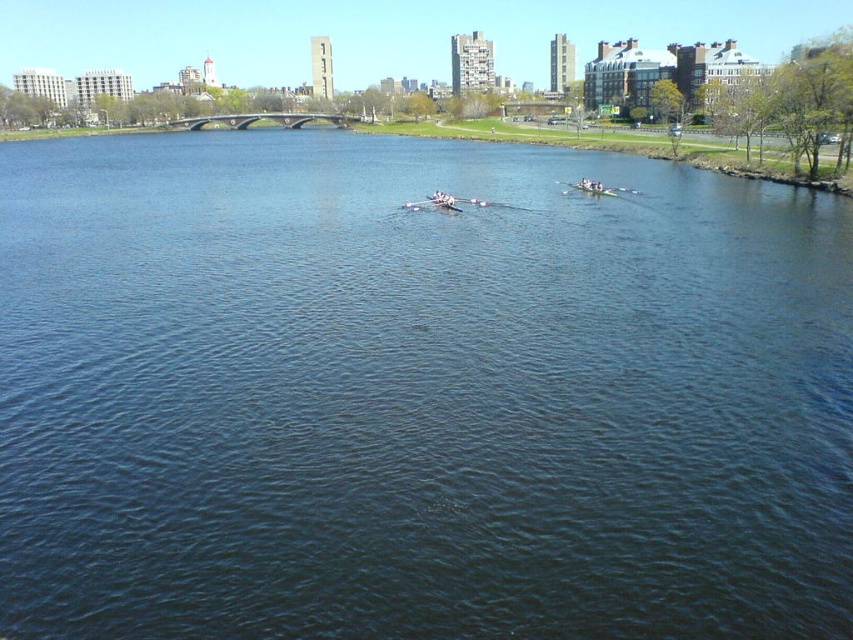
Between white glossy canoe at center and smooth white oar at center, which one appears on the left side from the viewer's perspective?

smooth white oar at center is more to the left.

Consider the image. Is white glossy canoe at center smaller than smooth white oar at center?

Actually, white glossy canoe at center might be larger than smooth white oar at center.

Is point (595, 189) behind point (418, 204)?

Yes, point (595, 189) is behind point (418, 204).

Where is `white glossy canoe at center`? This screenshot has height=640, width=853. white glossy canoe at center is located at coordinates (592, 188).